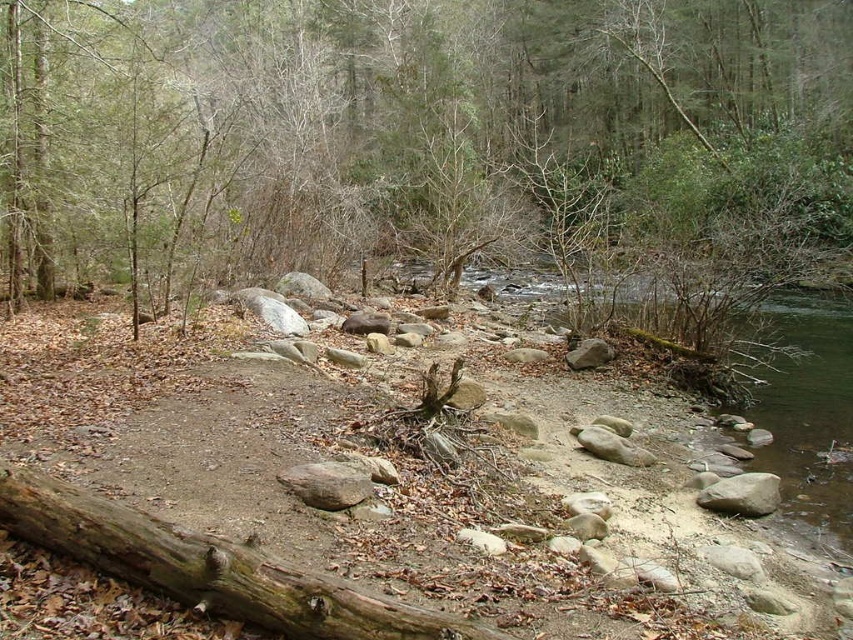
Question: Is brown wood tree at center in front of weathered brown log at lower left?

Choices:
 (A) no
 (B) yes

Answer: (A)

Question: Where is brown wood tree at center located in relation to weathered brown log at lower left in the image?

Choices:
 (A) left
 (B) right

Answer: (B)

Question: Which point appears farthest from the camera in this image?

Choices:
 (A) (67, 538)
 (B) (230, 236)

Answer: (B)

Question: Is brown wood tree at center bigger than weathered brown log at lower left?

Choices:
 (A) no
 (B) yes

Answer: (B)

Question: Which of the following is the farthest from the observer?

Choices:
 (A) brown wood tree at center
 (B) weathered brown log at lower left

Answer: (A)

Question: Which object is closer to the camera taking this photo?

Choices:
 (A) weathered brown log at lower left
 (B) brown wood tree at center

Answer: (A)